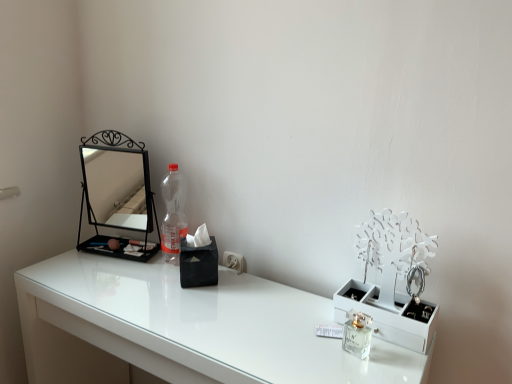
Where is `free space that is to the left of clear glass perfume at center`? Image resolution: width=512 pixels, height=384 pixels. free space that is to the left of clear glass perfume at center is located at coordinates (293, 343).